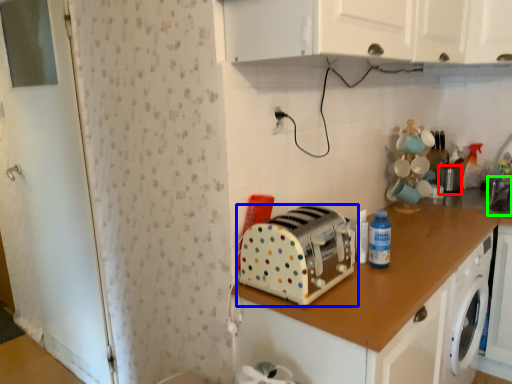
Question: Which object is positioned farthest from appliance (highlighted by a red box)? Select from toaster (highlighted by a blue box) and sink (highlighted by a green box).

Choices:
 (A) toaster
 (B) sink

Answer: (A)